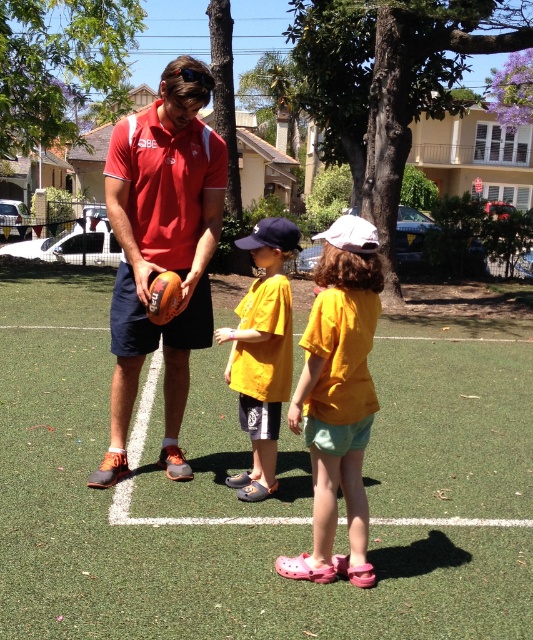
You are standing at the position of the viewer in the image. You want to walk to the green turf football field at center. How many steps would you need to take if each step is approximately 0.7 meters?

The distance between the viewer and the green turf football field at center is 3.36 meters. Since each step is 0.7 meters, dividing 3.36 by 0.7 gives exactly 4.8 steps. However, since you can only take whole steps, you would need to take 5 steps to reach the green turf football field at center.